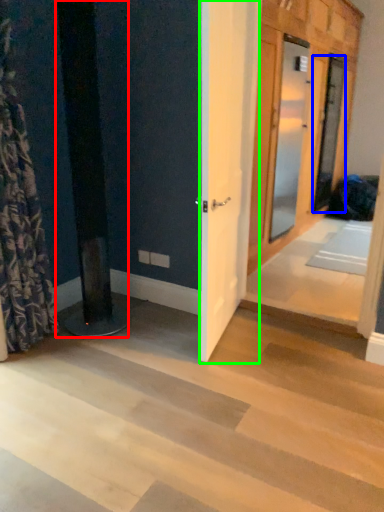
Question: Considering the real-world distances, which object is closest to pillar (highlighted by a red box)? door (highlighted by a blue box) or barn door (highlighted by a green box).

Choices:
 (A) door
 (B) barn door

Answer: (B)